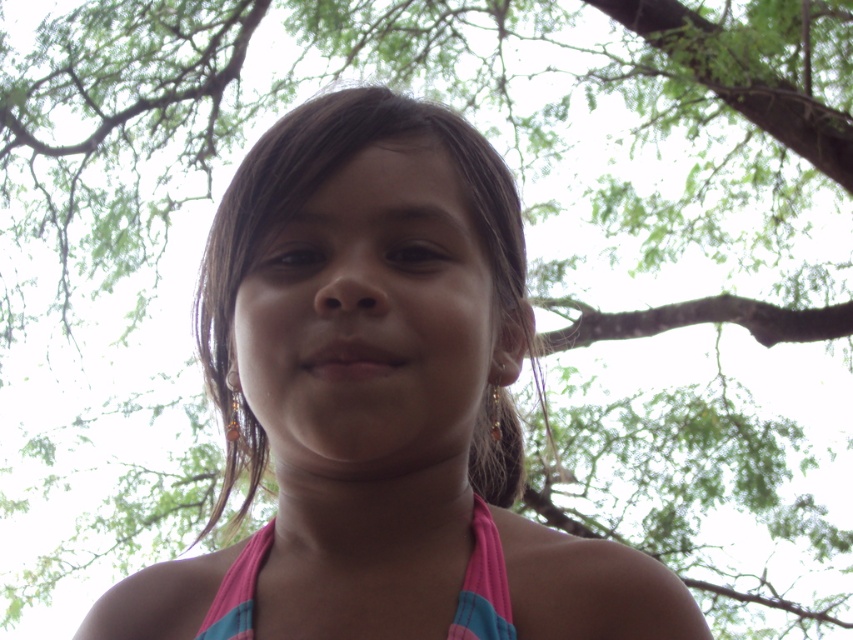
Which of these two, pink fabric at center or pink fabric bikini top at center, stands taller?

With more height is pink fabric at center.

Is pink fabric at center positioned behind pink fabric bikini top at center?

No.

Is point (334, 618) behind point (488, 609)?

Yes, point (334, 618) is behind point (488, 609).

This screenshot has height=640, width=853. I want to click on pink fabric at center, so click(379, 403).